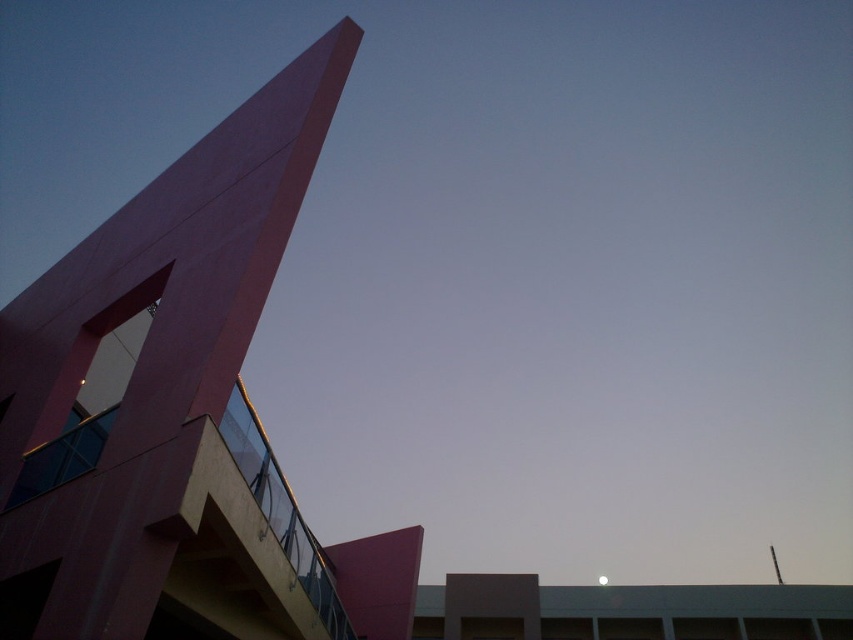
In the scene shown: Does matte pink tower at upper left have a greater width compared to white glossy moon at upper center?

In fact, matte pink tower at upper left might be narrower than white glossy moon at upper center.

Does matte pink tower at upper left appear on the right side of white glossy moon at upper center?

In fact, matte pink tower at upper left is to the left of white glossy moon at upper center.

What do you see at coordinates (167, 401) in the screenshot? The width and height of the screenshot is (853, 640). I see `matte pink tower at upper left` at bounding box center [167, 401].

Identify the location of matte pink tower at upper left. (167, 401).